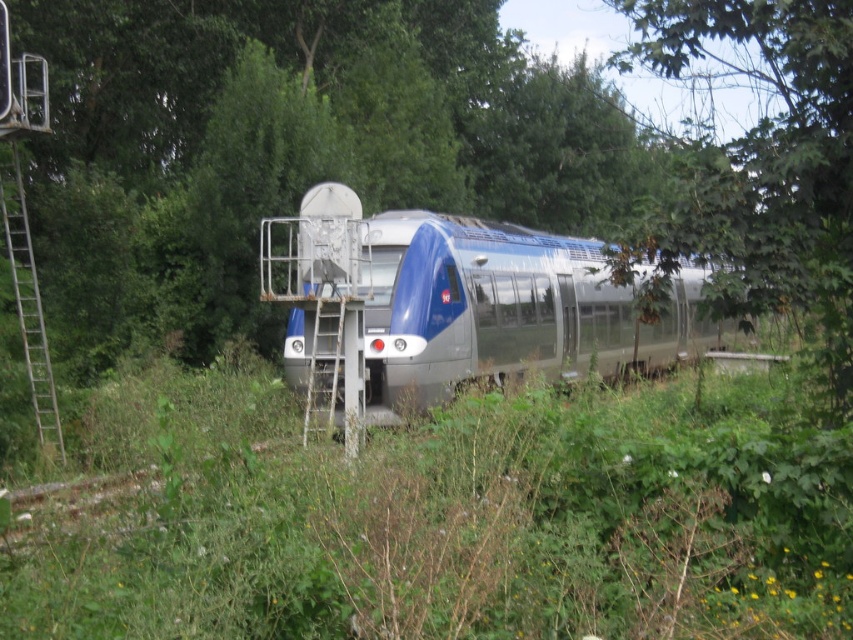
Who is more forward, (553, 253) or (1, 192)?

Point (1, 192) is in front.

Which is below, metallic blue train at center or metallic silver ladder at left?

metallic silver ladder at left is below.

Find the location of a particular element. The height and width of the screenshot is (640, 853). metallic blue train at center is located at coordinates (476, 300).

At what (x,y) coordinates should I click in order to perform the action: click on metallic blue train at center. Please return your answer as a coordinate pair (x, y). This screenshot has height=640, width=853. Looking at the image, I should click on (476, 300).

From the picture: Between green grass at center and metallic silver ladder at left, which one is positioned higher?

green grass at center is higher up.

Measure the distance between green grass at center and camera.

green grass at center and camera are 2.88 meters apart from each other.

This screenshot has height=640, width=853. Identify the location of green grass at center. (447, 518).

Can you confirm if green grass at center is positioned below metallic blue train at center?

Indeed, green grass at center is positioned under metallic blue train at center.

Can you confirm if green grass at center is wider than metallic blue train at center?

Incorrect, green grass at center's width does not surpass metallic blue train at center's.

Is point (7, 630) farther from viewer compared to point (328, 292)?

No, (7, 630) is in front of (328, 292).

Locate an element on the screen. green grass at center is located at coordinates (447, 518).